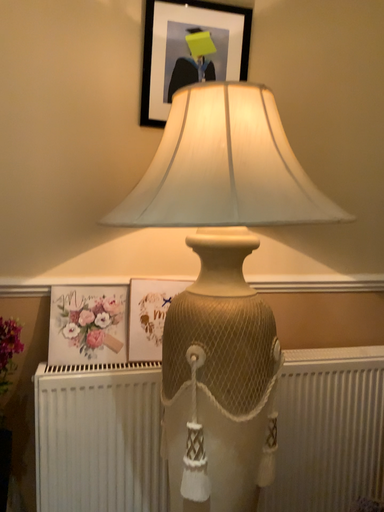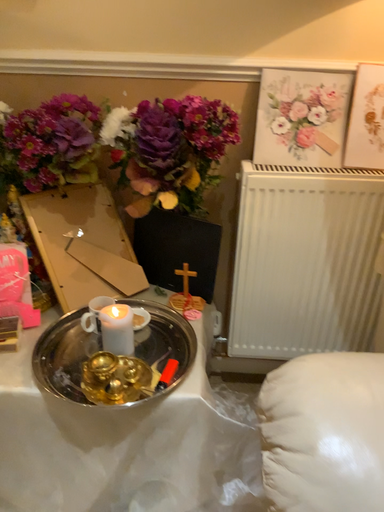
Question: Which way did the camera rotate in the video?

Choices:
 (A) rotated upward
 (B) rotated downward

Answer: (B)